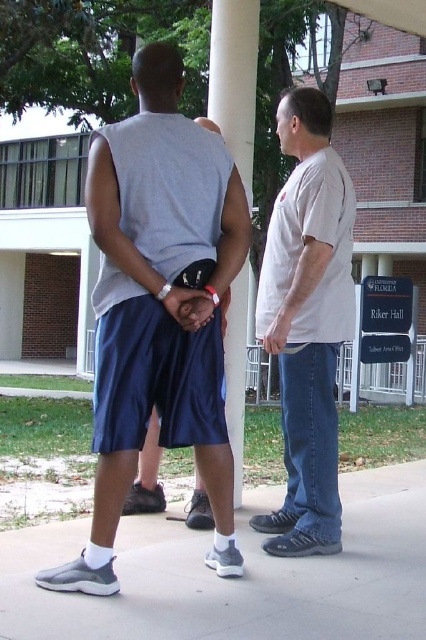
Question: Does gray rubber shoe at lower center appear on the right side of matte gray concrete porch at center?

Choices:
 (A) no
 (B) yes

Answer: (B)

Question: Among these points, which one is farthest from the camera?

Choices:
 (A) (233, 29)
 (B) (8, 220)

Answer: (B)

Question: Considering the relative positions of gray rubber shoe at lower center and matte gray concrete porch at center in the image provided, where is gray rubber shoe at lower center located with respect to matte gray concrete porch at center?

Choices:
 (A) right
 (B) left

Answer: (A)

Question: Does blue satin shorts at center come in front of white smooth pillar at center?

Choices:
 (A) yes
 (B) no

Answer: (A)

Question: Which point is closer to the camera?

Choices:
 (A) gray rubber shoe at lower center
 (B) blue satin shorts at center

Answer: (A)

Question: Estimate the real-world distances between objects in this image. Which object is farther from the matte gray concrete porch at center?

Choices:
 (A) gray rubber shoe at lower center
 (B) blue satin shorts at center
 (C) white matte t-shirt at center
 (D) white smooth pillar at center

Answer: (D)